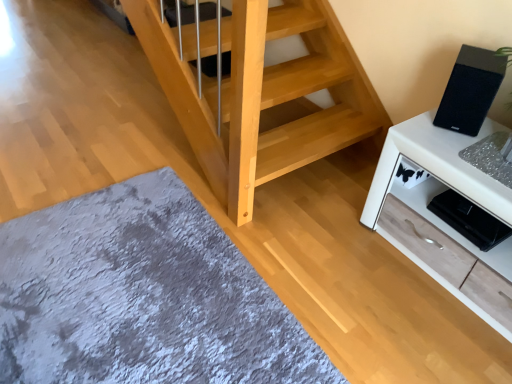
Question: Is black matte speaker at upper right positioned with its back to gray plush rug at lower left?

Choices:
 (A) yes
 (B) no

Answer: (B)

Question: From the image's perspective, does black matte speaker at upper right appear higher than gray plush rug at lower left?

Choices:
 (A) yes
 (B) no

Answer: (A)

Question: Are black matte speaker at upper right and gray plush rug at lower left beside each other?

Choices:
 (A) yes
 (B) no

Answer: (B)

Question: Is black matte speaker at upper right wider than gray plush rug at lower left?

Choices:
 (A) yes
 (B) no

Answer: (B)

Question: From a real-world perspective, is black matte speaker at upper right positioned over gray plush rug at lower left based on gravity?

Choices:
 (A) no
 (B) yes

Answer: (B)

Question: From their relative heights in the image, would you say gray plush rug at lower left is taller or shorter than white wood cabinet at right?

Choices:
 (A) tall
 (B) short

Answer: (B)

Question: In terms of width, does gray plush rug at lower left look wider or thinner when compared to white wood cabinet at right?

Choices:
 (A) thin
 (B) wide

Answer: (B)

Question: Is gray plush rug at lower left to the left or to the right of white wood cabinet at right in the image?

Choices:
 (A) left
 (B) right

Answer: (A)

Question: Do you think gray plush rug at lower left is within white wood cabinet at right, or outside of it?

Choices:
 (A) outside
 (B) inside

Answer: (A)

Question: Based on their positions, is white wood cabinet at right located to the left or right of black matte speaker at upper right?

Choices:
 (A) right
 (B) left

Answer: (A)

Question: Is point (495, 321) closer or farther from the camera than point (494, 87)?

Choices:
 (A) closer
 (B) farther

Answer: (B)

Question: From a real-world perspective, relative to black matte speaker at upper right, is white wood cabinet at right vertically above or below?

Choices:
 (A) above
 (B) below

Answer: (B)

Question: In terms of width, does white wood cabinet at right look wider or thinner when compared to black matte speaker at upper right?

Choices:
 (A) wide
 (B) thin

Answer: (A)

Question: Considering the positions of white wood cabinet at right and gray plush rug at lower left in the image, is white wood cabinet at right wider or thinner than gray plush rug at lower left?

Choices:
 (A) thin
 (B) wide

Answer: (A)

Question: From the image's perspective, is white wood cabinet at right located above or below gray plush rug at lower left?

Choices:
 (A) above
 (B) below

Answer: (A)